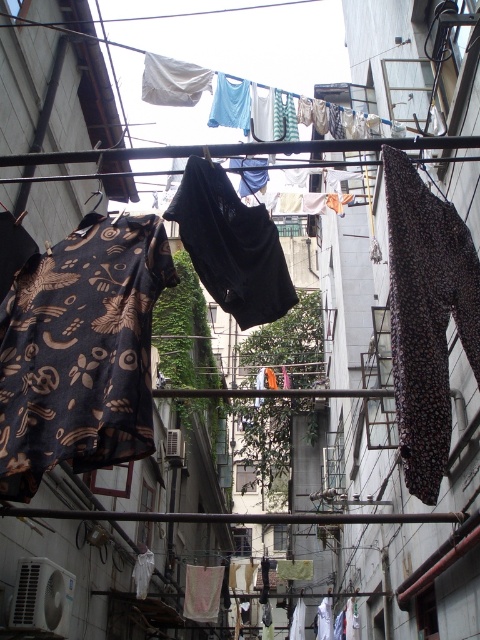
You are a delivery person carrying a 7 feet long package. You need to navigate through the narrow alleyway between the two buildings. There are two items hanging from the clotheslines in the alleyway, a brown printed fabric shirt at left and a brown dotted fabric at right. Can you pass through the alleyway without touching any of the hanging items?

The distance between the brown printed fabric shirt at left and brown dotted fabric at right is 6.97 feet. Since your package is 7 feet long, it is slightly longer than the gap between the two items. Therefore, you cannot pass through the alleyway without touching the hanging items.

You are a tailor who needs to determine which fabric piece is wider between the brown printed fabric shirt at left and the brown dotted fabric at right. Which one has a greater width?

The brown printed fabric shirt at left has a greater width than the brown dotted fabric at right according to the description.